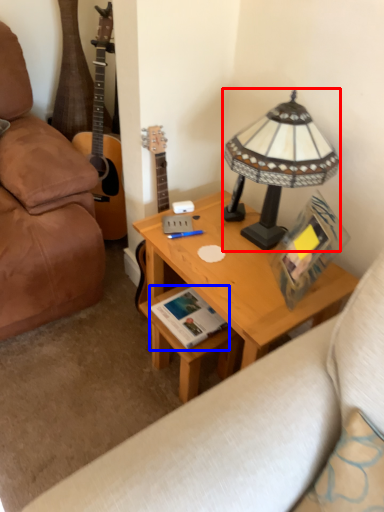
Question: Which object is further to the camera taking this photo, lamp (highlighted by a red box) or book (highlighted by a blue box)?

Choices:
 (A) lamp
 (B) book

Answer: (B)